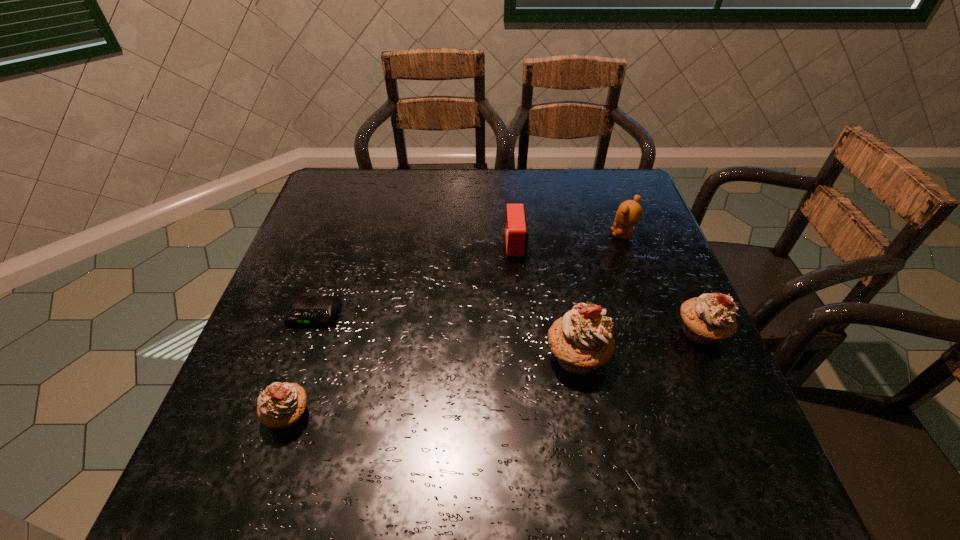
Locate an element on the screen. vacant region that satisfies the following two spatial constraints: 1. on the front-facing side of the farther alarm clock; 2. on the display of the left alarm clock is located at coordinates tap(522, 315).

The width and height of the screenshot is (960, 540). Find the location of `blank space that satisfies the following two spatial constraints: 1. on the face of the fifth object from left to right; 2. on the front side of the nearest cupcake`. blank space that satisfies the following two spatial constraints: 1. on the face of the fifth object from left to right; 2. on the front side of the nearest cupcake is located at coordinates (687, 414).

I want to click on vacant area in the image that satisfies the following two spatial constraints: 1. on the front-facing side of the rightmost object; 2. on the left side of the fourth object from right to left, so click(x=524, y=332).

You are a GUI agent. You are given a task and a screenshot of the screen. Output one action in this format:
    pyautogui.click(x=<x>, y=<y>)
    Task: Click on the vacant point that satisfies the following two spatial constraints: 1. on the display of the rightmost cupcake; 2. on the left side of the shorter alarm clock
    Image resolution: width=960 pixels, height=540 pixels.
    Given the screenshot: What is the action you would take?
    pyautogui.click(x=308, y=332)

Image resolution: width=960 pixels, height=540 pixels. What are the coordinates of `free location that satisfies the following two spatial constraints: 1. on the back side of the third object from right to left; 2. on the front-facing side of the fourth object from right to left` in the screenshot? It's located at (556, 244).